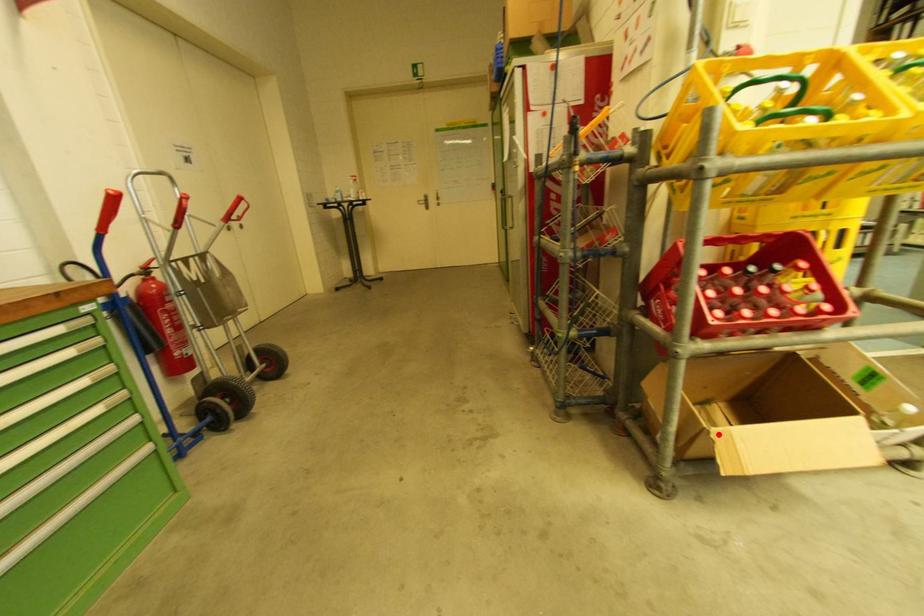
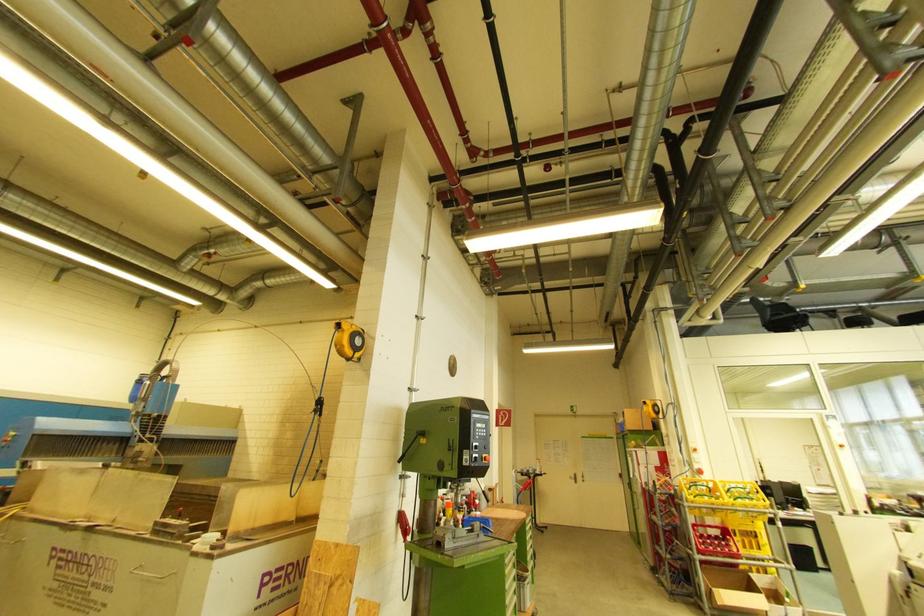
Question: A red point is marked in image1. In image2, is the corresponding 3D point closer to the camera or farther? Reply with the corresponding letter.

Choices:
 (A) The corresponding 3D point is closer.
 (B) The corresponding 3D point is farther.

Answer: (A)